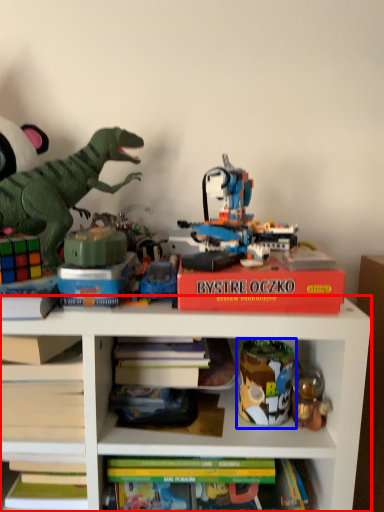
Question: Which of the following is the farthest to the observer, shelf (highlighted by a red box) or toy (highlighted by a blue box)?

Choices:
 (A) shelf
 (B) toy

Answer: (B)